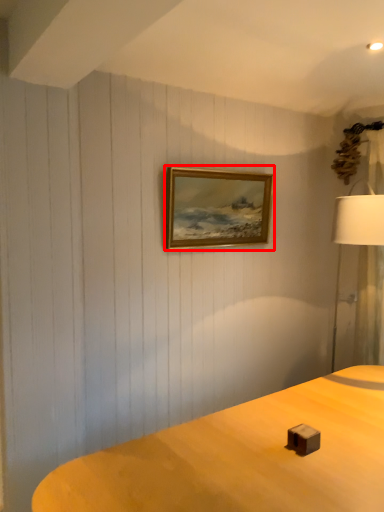
Question: From the image's perspective, what is the correct spatial positioning of picture frame (annotated by the red box) in reference to lamp?

Choices:
 (A) below
 (B) above

Answer: (B)